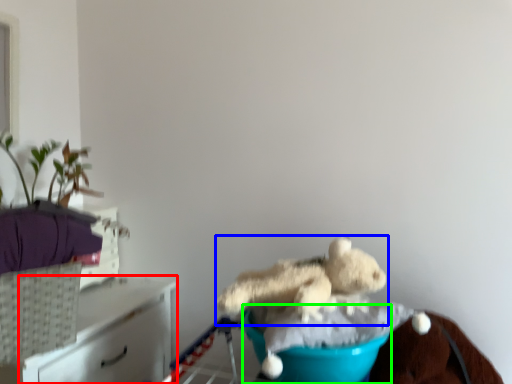
Question: Which object is positioned farthest from furniture (highlighted by a red box)? Select from teddy bear (highlighted by a blue box) and teal (highlighted by a green box).

Choices:
 (A) teddy bear
 (B) teal

Answer: (B)